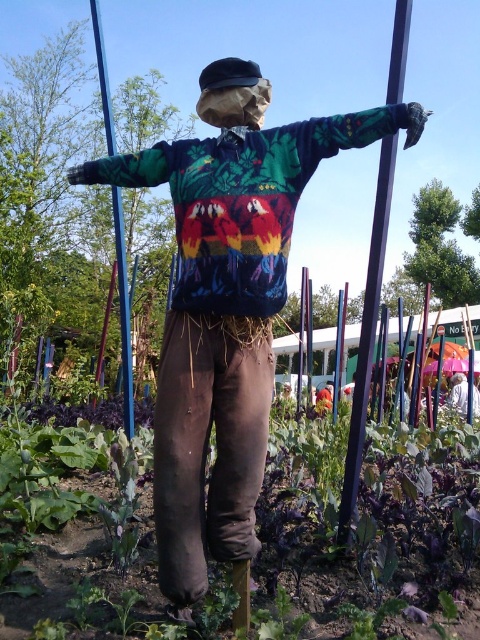
Is point (109, 104) positioned before point (320, 394)?

Yes.

Is point (122, 307) farther from viewer compared to point (328, 394)?

No, it is not.

Image resolution: width=480 pixels, height=640 pixels. In order to click on green plastic pole at center in this screenshot , I will do `click(123, 314)`.

Does green plastic pole at center have a greater width compared to white fabric umbrella at lower right?

Yes, green plastic pole at center is wider than white fabric umbrella at lower right.

Can you confirm if green plastic pole at center is positioned to the right of white fabric umbrella at lower right?

No, green plastic pole at center is not to the right of white fabric umbrella at lower right.

Between point (109, 118) and point (458, 412), which one is positioned in front?

Point (109, 118) is more forward.

Identify the location of green plastic pole at center. (123, 314).

Is purple glossy pole at center above orange fabric shirt at center?

Yes, purple glossy pole at center is above orange fabric shirt at center.

Is point (371, 240) farther from viewer compared to point (323, 400)?

No, (371, 240) is in front of (323, 400).

This screenshot has height=640, width=480. I want to click on purple glossy pole at center, so click(367, 333).